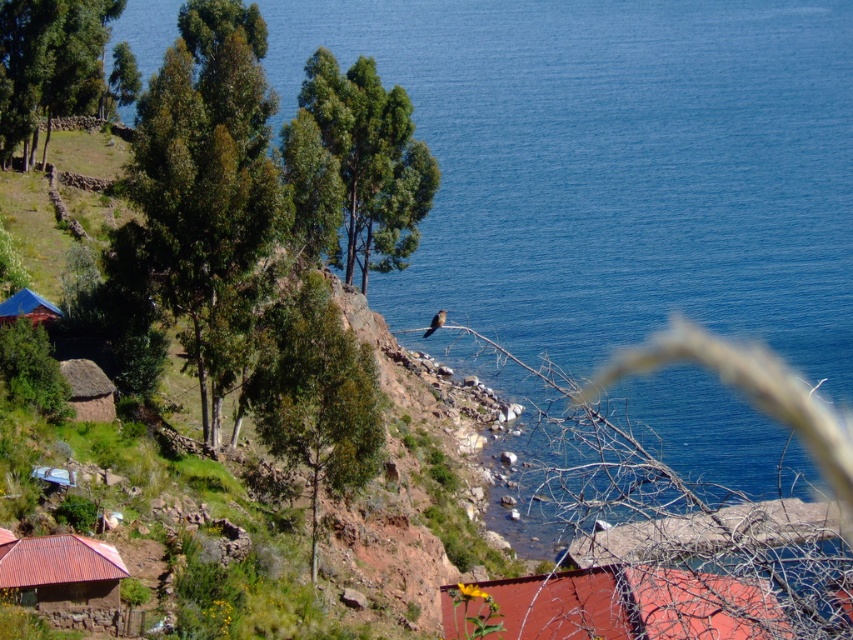
Question: Does blue water at center lie in front of thatched brown hut at lower left?

Choices:
 (A) yes
 (B) no

Answer: (A)

Question: Which of the following is the farthest from the observer?

Choices:
 (A) (114, 588)
 (B) (283, 372)
 (C) (757, 586)

Answer: (B)

Question: Is green leafy tree at center below green leafy tree at upper center?

Choices:
 (A) yes
 (B) no

Answer: (A)

Question: Which point appears closest to the camera in this image?

Choices:
 (A) (39, 305)
 (B) (253, 125)

Answer: (A)

Question: Can you confirm if blue water at center is thinner than green leafy tree at left?

Choices:
 (A) yes
 (B) no

Answer: (B)

Question: Among these objects, which one is farthest from the camera?

Choices:
 (A) rusty corrugated metal hut at lower left
 (B) green grassy hillside at lower left

Answer: (B)